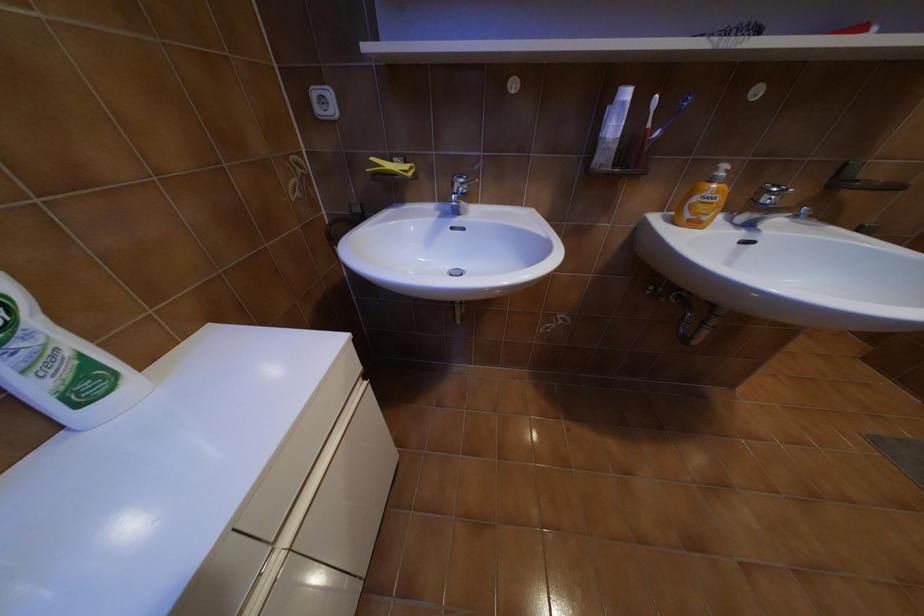
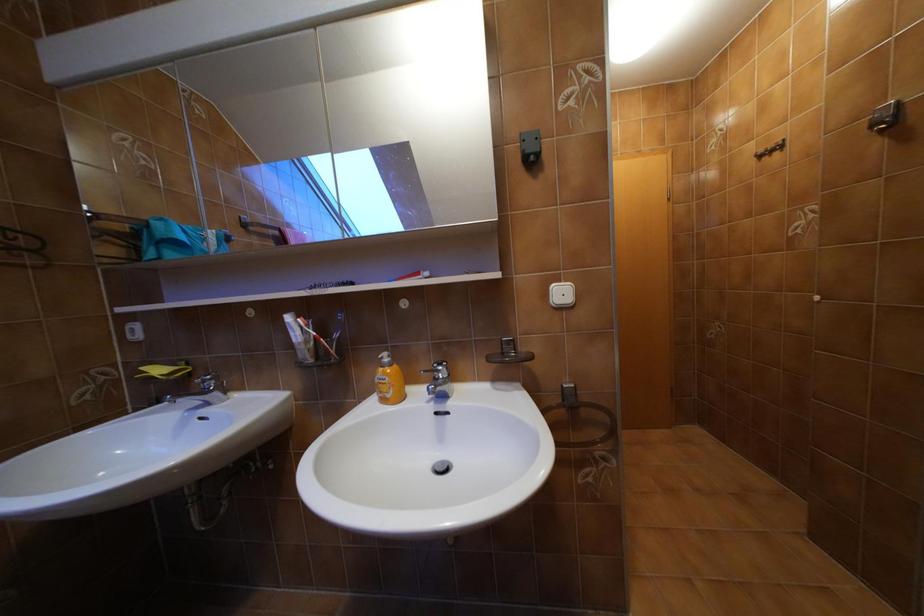
Question: The images are taken continuously from a first-person perspective. In which direction is your viewpoint rotating?

Choices:
 (A) Left
 (B) Right
 (C) Up
 (D) Down

Answer: (C)